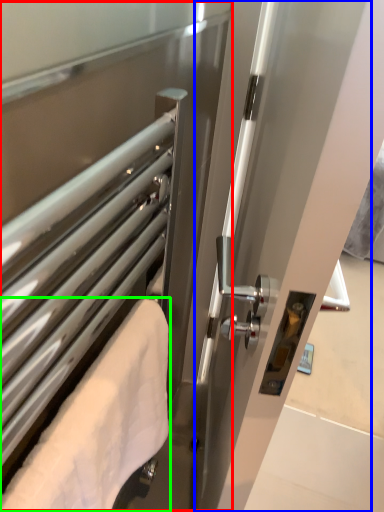
Question: Which object is the closest to the screen door (highlighted by a red box)? Choose among these: screen door (highlighted by a blue box) or towel (highlighted by a green box).

Choices:
 (A) screen door
 (B) towel

Answer: (B)